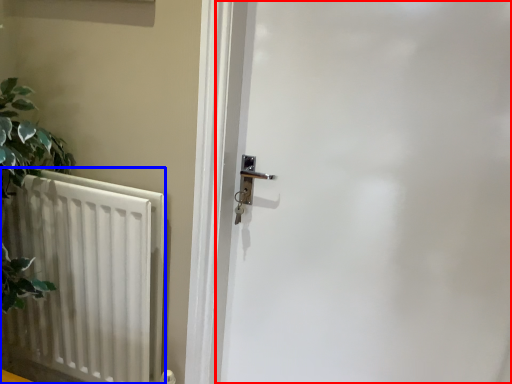
Question: Which point is closer to the camera, door (highlighted by a red box) or radiator (highlighted by a blue box)?

Choices:
 (A) door
 (B) radiator

Answer: (A)